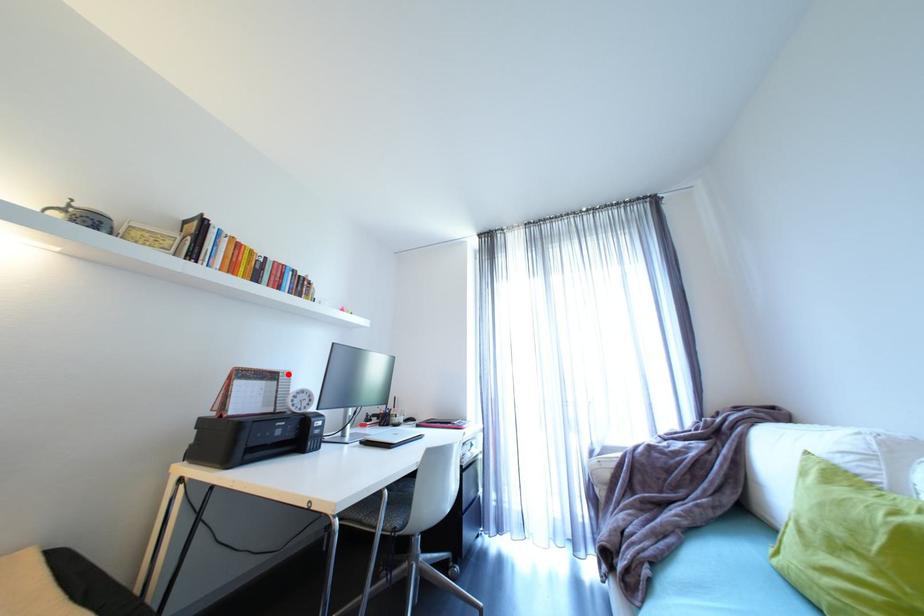
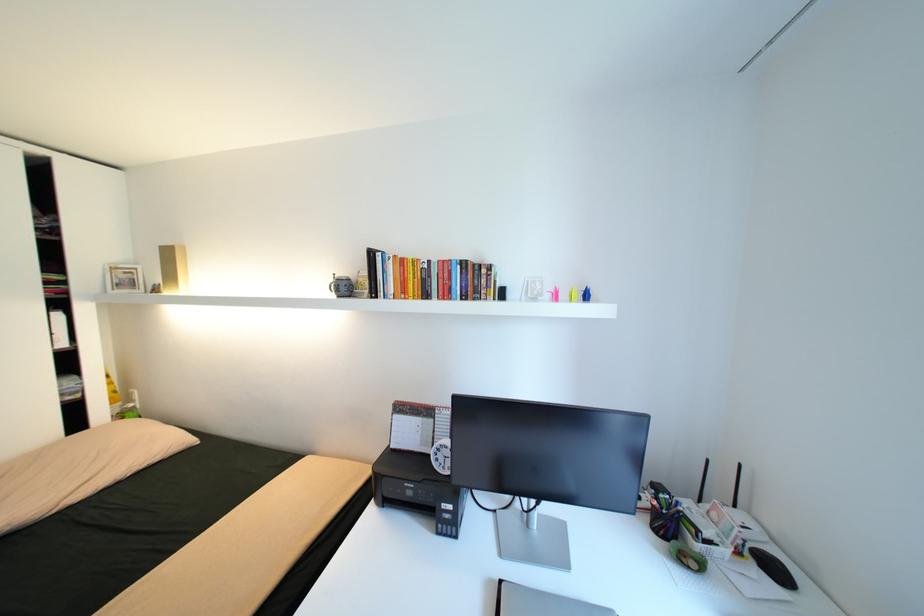
Question: A red point is marked in image1. In image2, is the corresponding 3D point closer to the camera or farther? Reply with the corresponding letter.

Choices:
 (A) The corresponding 3D point is closer.
 (B) The corresponding 3D point is farther.

Answer: (B)